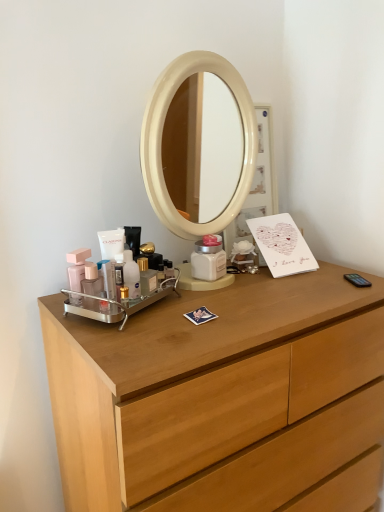
Question: Should I look upward or downward to see translucent plastic tube at center, which is counted as the third toiletry, starting from the left?

Choices:
 (A) down
 (B) up

Answer: (A)

Question: Is translucent plastic tube at center, which is counted as the third toiletry, starting from the left, further to the viewer compared to translucent plastic bottle at center, placed as the fourth toiletry when sorted from left to right?

Choices:
 (A) yes
 (B) no

Answer: (B)

Question: From the image's perspective, would you say translucent plastic tube at center, the second toiletry viewed from the right, is shown under translucent plastic bottle at center, the 1th toiletry when ordered from right to left?

Choices:
 (A) yes
 (B) no

Answer: (A)

Question: Is translucent plastic tube at center, the second toiletry viewed from the right, touching translucent plastic bottle at center, placed as the fourth toiletry when sorted from left to right?

Choices:
 (A) no
 (B) yes

Answer: (B)

Question: Is translucent plastic bottle at center, placed as the fourth toiletry when sorted from left to right, inside translucent plastic tube at center, the second toiletry viewed from the right?

Choices:
 (A) yes
 (B) no

Answer: (B)

Question: Is translucent plastic tube at center, which is counted as the third toiletry, starting from the left, not within translucent plastic bottle at center, the 1th toiletry when ordered from right to left?

Choices:
 (A) no
 (B) yes

Answer: (B)

Question: Is translucent plastic tube at center, the second toiletry viewed from the right, wider than translucent plastic bottle at center, placed as the fourth toiletry when sorted from left to right?

Choices:
 (A) no
 (B) yes

Answer: (A)

Question: From a real-world perspective, is matte pink bottle at left, the second toiletry from the left, located beneath translucent plastic tube at center, the second toiletry viewed from the right?

Choices:
 (A) no
 (B) yes

Answer: (B)

Question: From the image's perspective, is matte pink bottle at left, the second toiletry from the left, located beneath translucent plastic tube at center, which is counted as the third toiletry, starting from the left?

Choices:
 (A) yes
 (B) no

Answer: (B)

Question: Is matte pink bottle at left, the second toiletry from the left, positioned in front of translucent plastic tube at center, which is counted as the third toiletry, starting from the left?

Choices:
 (A) no
 (B) yes

Answer: (A)

Question: Is matte pink bottle at left, the second toiletry from the left, positioned with its back to translucent plastic tube at center, which is counted as the third toiletry, starting from the left?

Choices:
 (A) no
 (B) yes

Answer: (A)

Question: From a real-world perspective, is matte pink bottle at left, the second toiletry from the left, located higher than translucent plastic tube at center, the second toiletry viewed from the right?

Choices:
 (A) no
 (B) yes

Answer: (A)

Question: Does matte pink bottle at left, the second toiletry from the left, appear on the left side of translucent plastic tube at center, the second toiletry viewed from the right?

Choices:
 (A) yes
 (B) no

Answer: (A)

Question: Does translucent plastic bottle at center, placed as the fourth toiletry when sorted from left to right, have a smaller size compared to matte pink bottle at left, the second toiletry from the left?

Choices:
 (A) yes
 (B) no

Answer: (B)